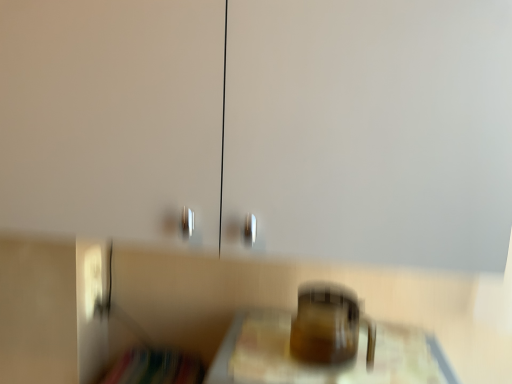
Find the location of `free space above translucent glass jar at center (from a real-world perspective)`. free space above translucent glass jar at center (from a real-world perspective) is located at coordinates (362, 367).